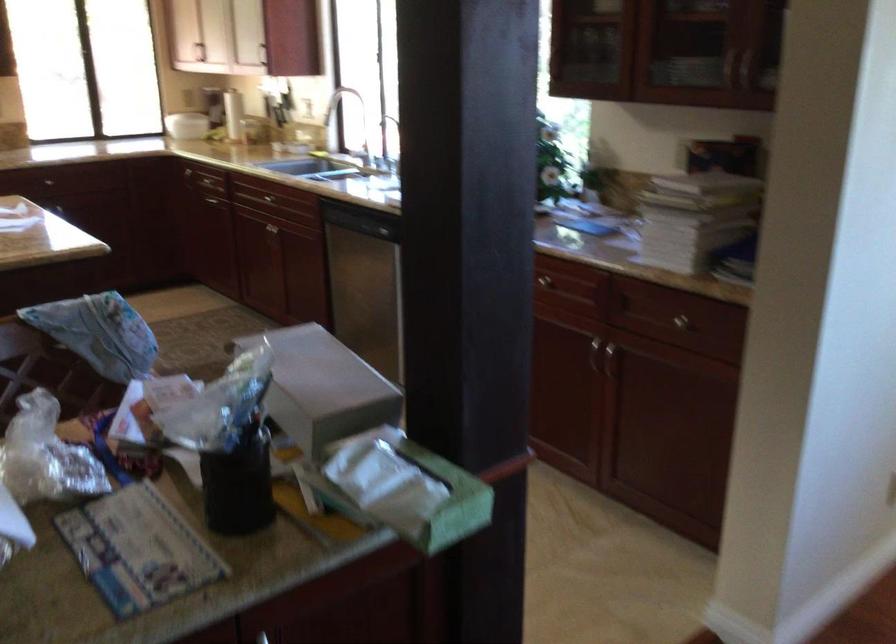
The location [410,491] corresponds to which object?

It refers to a green tissue box.